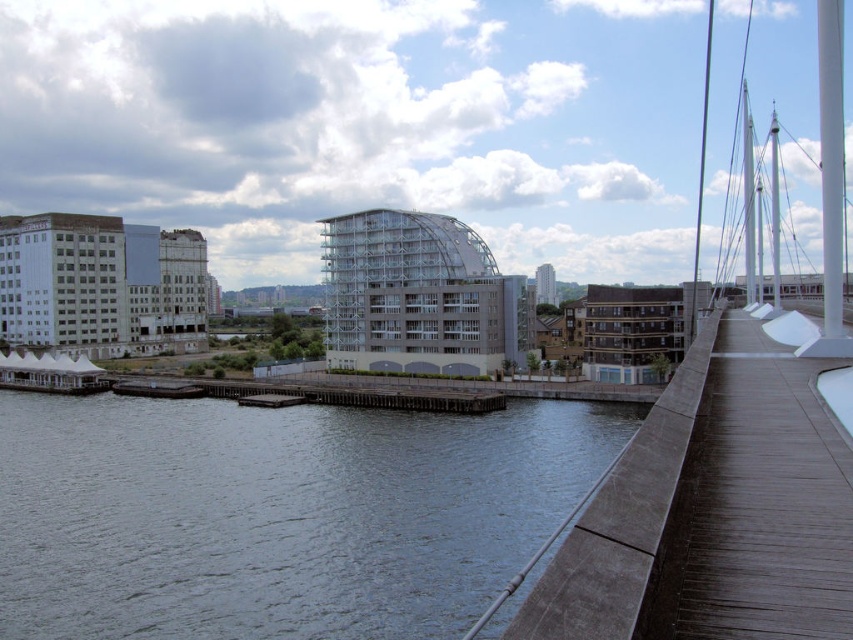
Can you confirm if dark gray water at lower left is smaller than brown wooden path at right?

No, dark gray water at lower left is not smaller than brown wooden path at right.

Which is above, dark gray water at lower left or brown wooden path at right?

brown wooden path at right is above.

Where is `dark gray water at lower left`? dark gray water at lower left is located at coordinates (277, 515).

You are a GUI agent. You are given a task and a screenshot of the screen. Output one action in this format:
    pyautogui.click(x=<x>, y=<y>)
    Task: Click on the dark gray water at lower left
    The image size is (853, 640).
    Given the screenshot: What is the action you would take?
    pyautogui.click(x=277, y=515)